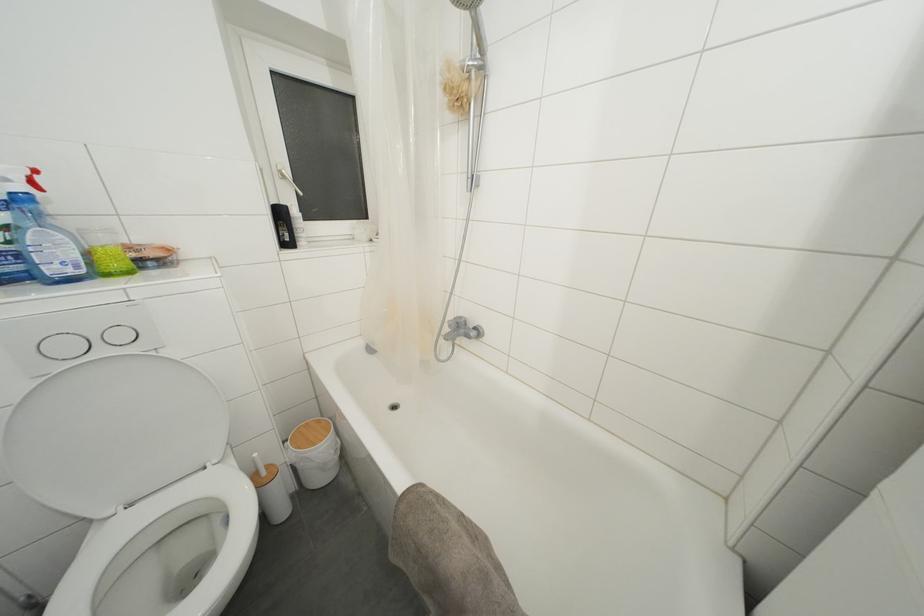
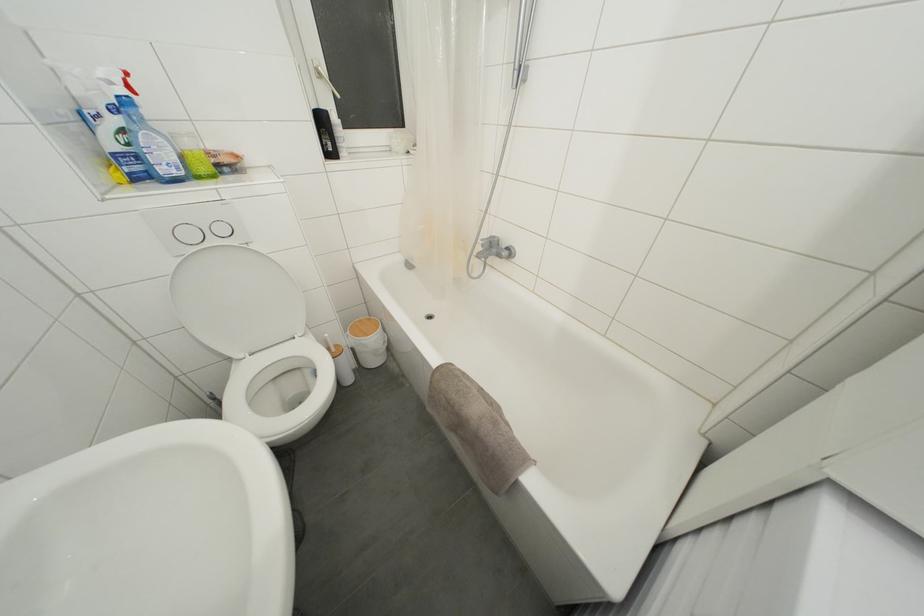
In the second image, find the point that corresponds to point (455, 321) in the first image.

(488, 240)